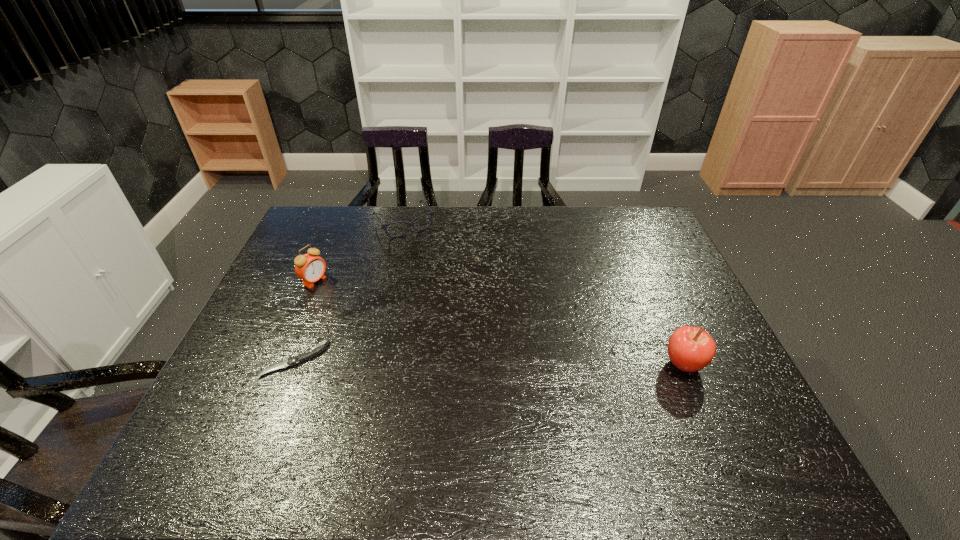
The width and height of the screenshot is (960, 540). I want to click on the shortest object, so click(310, 353).

Find the location of a particular element. The height and width of the screenshot is (540, 960). apple is located at coordinates (690, 349).

Locate an element on the screen. The height and width of the screenshot is (540, 960). the farthest object is located at coordinates (409, 224).

Find the location of a particular element. The height and width of the screenshot is (540, 960). the second object from right to left is located at coordinates (409, 224).

I want to click on the third nearest object, so click(310, 268).

The height and width of the screenshot is (540, 960). What are the coordinates of `free location located 0.230m on the back of the pocketknife` in the screenshot? It's located at (325, 283).

Locate an element on the screen. The height and width of the screenshot is (540, 960). vacant position located on the left of the apple is located at coordinates (523, 364).

At what (x,y) coordinates should I click in order to perform the action: click on vacant area situated on the front-facing side of the farthest object. Please return your answer as a coordinate pair (x, y). The height and width of the screenshot is (540, 960). Looking at the image, I should click on (443, 277).

Identify the location of free location located on the front-facing side of the farthest object. This screenshot has width=960, height=540. (437, 269).

The image size is (960, 540). What are the coordinates of `vacant point located 0.070m on the front-facing side of the farthest object` in the screenshot? It's located at (423, 249).